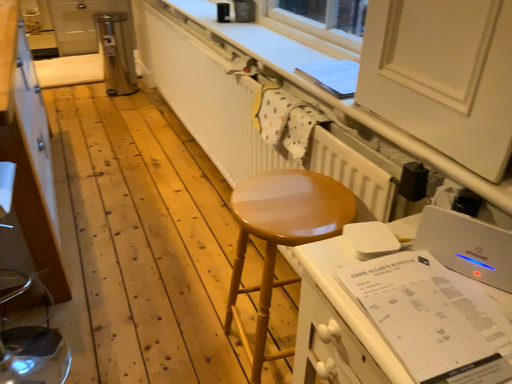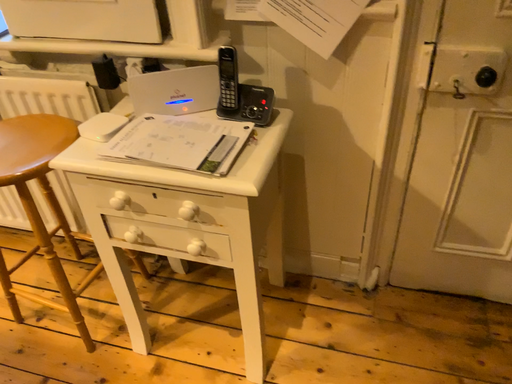
Question: Which way did the camera rotate in the video?

Choices:
 (A) rotated right
 (B) rotated left

Answer: (A)